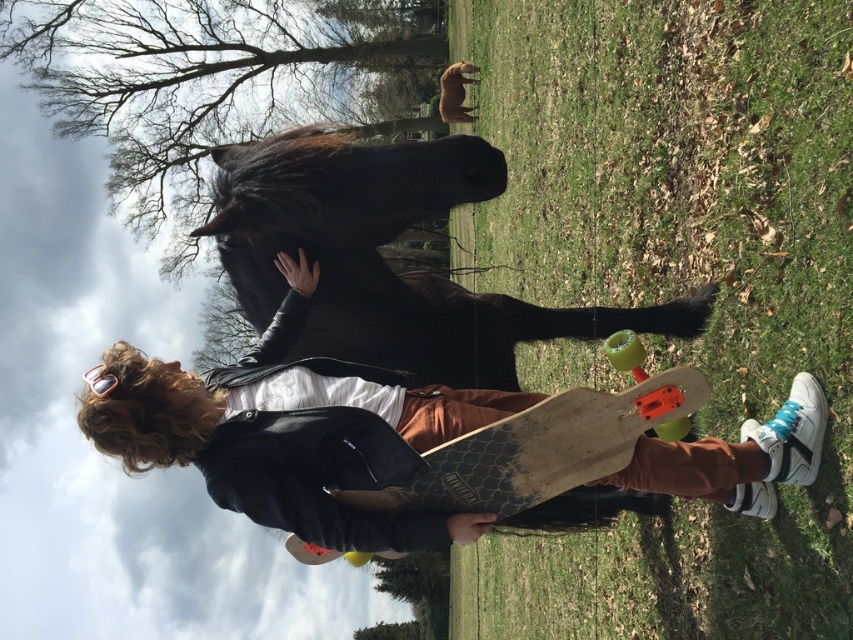
You are a photographer setting up a shoot in the grassy area. You have a wooden skateboard at center and a wooden textured skateboard at center. Which one is placed on top of the other?

The wooden skateboard at center is positioned over wooden textured skateboard at center.

Based on the photo, you are a photographer trying to capture a clear photo of the black glossy horse at center without the wooden skateboard at center blocking the view. Based on their positions, can you position yourself in a way to avoid the skateboard?

The wooden skateboard at center is behind the black glossy horse at center, so positioning yourself in front of the horse will ensure the skateboard is hidden behind the horse, providing an unobstructed view of the horse.

You are a photographer trying to capture a closeup of the black glossy horse at center. The camera you are using has a focal length of 100mm and an aperture of f2.8. If the horse is located at point coordinates of 0.409, 0.453, what is the best way to frame the shot to ensure the horse is the main focus?

Since the black glossy horse at center is located at coordinates (386, 289), you should position the camera so that the horse is centered in the frame to make it the main focus.